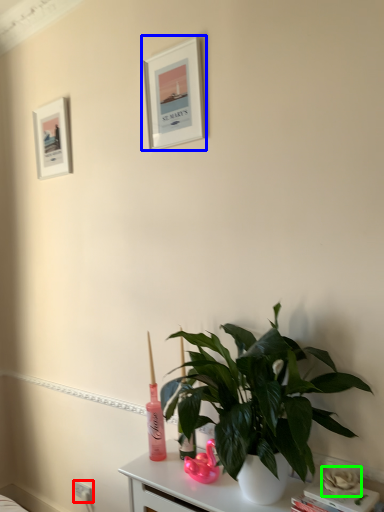
Question: Which object is positioned closest to electric outlet (highlighted by a red box)? Select from picture frame (highlighted by a blue box) and flower (highlighted by a green box).

Choices:
 (A) picture frame
 (B) flower

Answer: (B)